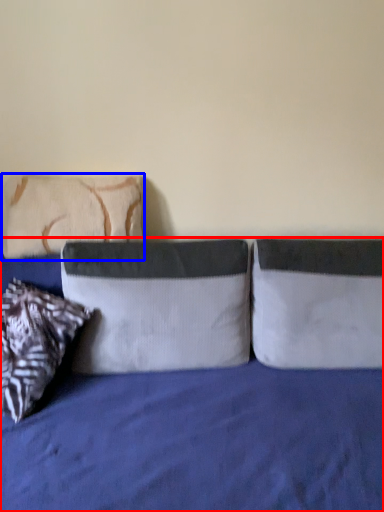
Question: Which point is closer to the camera, bed (highlighted by a red box) or pillow (highlighted by a blue box)?

Choices:
 (A) bed
 (B) pillow

Answer: (A)